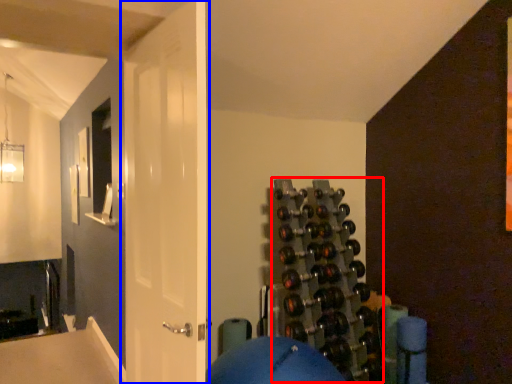
Question: Which object is closer to the camera taking this photo, wine rack (highlighted by a red box) or door (highlighted by a blue box)?

Choices:
 (A) wine rack
 (B) door

Answer: (B)